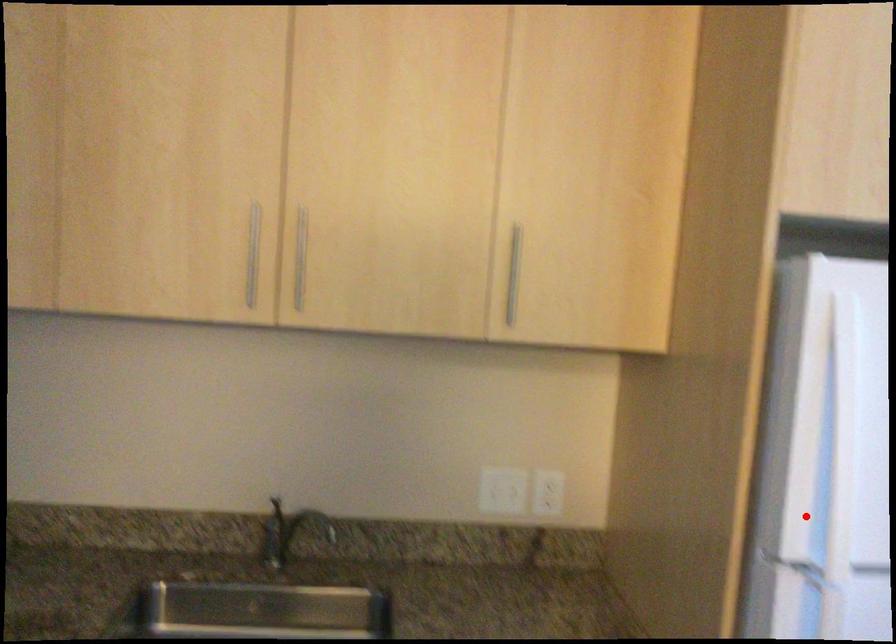
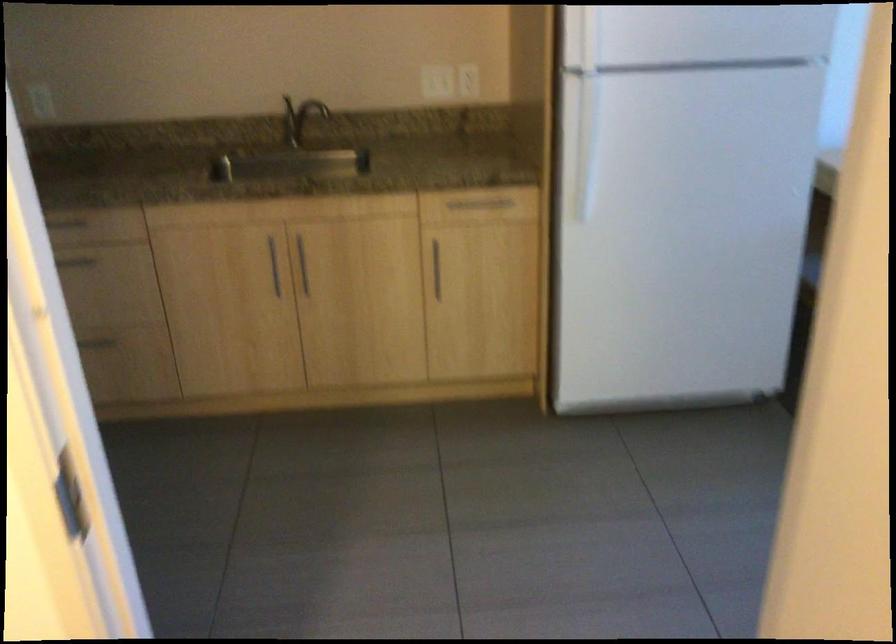
Question: I am providing you with two images of the same scene from different viewpoints. Given a red point in image1, look at the same physical point in image2. Is it:

Choices:
 (A) Closer to the viewpoint
 (B) Farther from the viewpoint

Answer: (B)